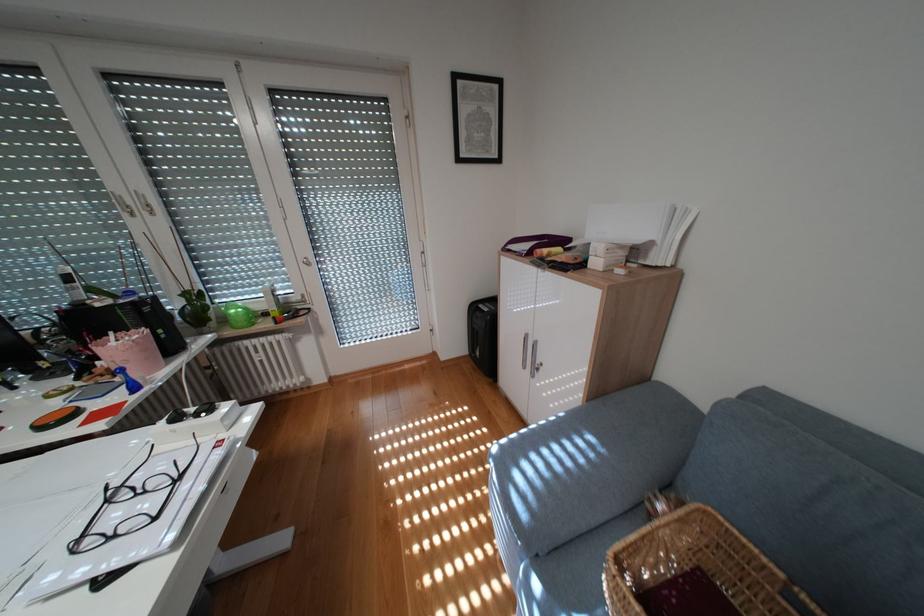
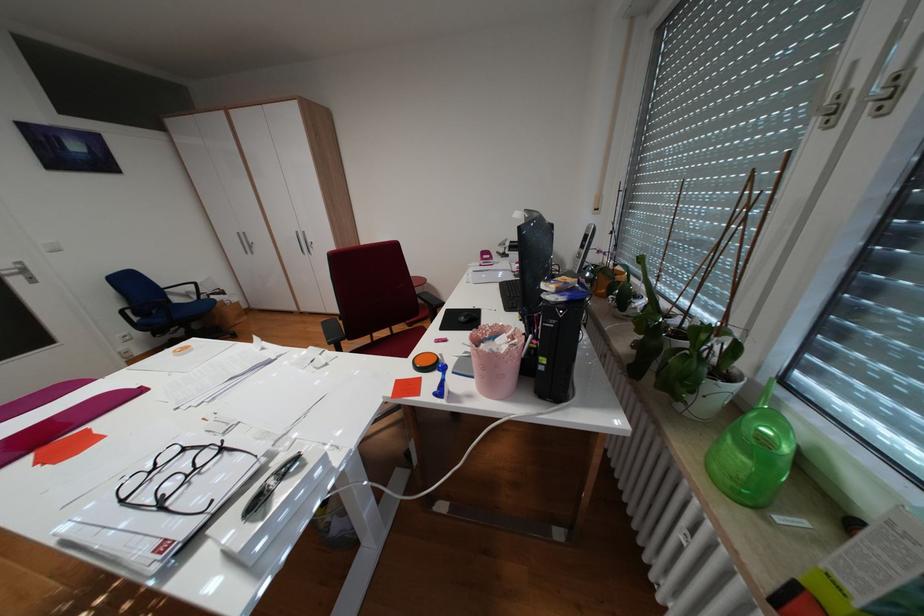
Locate, in the second image, the point that corresponds to [219,329] in the first image.

(691, 405)